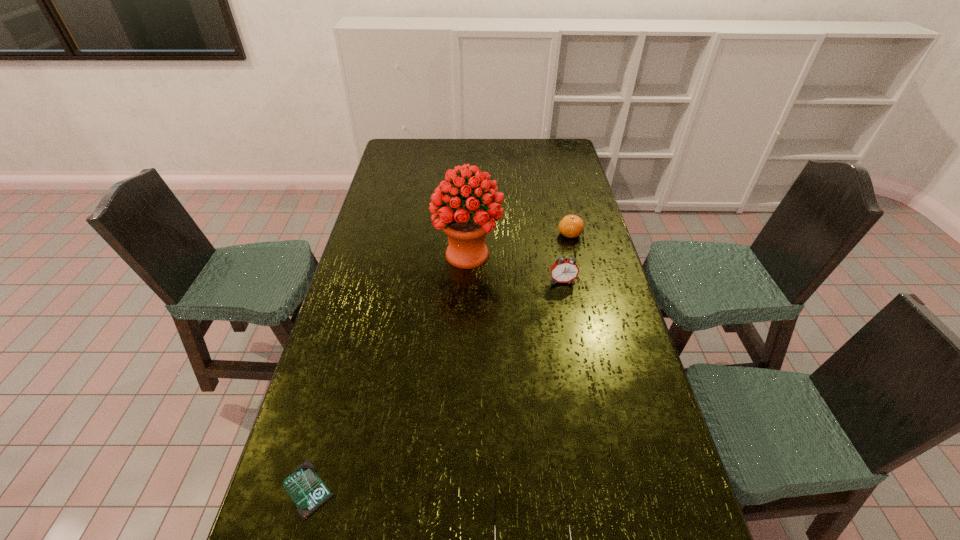
Find the location of a particular element. bouquet is located at coordinates (466, 226).

This screenshot has height=540, width=960. In order to click on the third farthest object in this screenshot , I will do `click(566, 270)`.

I want to click on the second tallest object, so click(566, 270).

This screenshot has height=540, width=960. In order to click on the third tallest object in this screenshot , I will do `click(571, 226)`.

Identify the location of the leftmost object. (304, 486).

You are a GUI agent. You are given a task and a screenshot of the screen. Output one action in this format:
    pyautogui.click(x=<x>, y=<y>)
    Task: Click on the shortest object
    The width and height of the screenshot is (960, 540).
    Given the screenshot: What is the action you would take?
    click(304, 486)

Find the location of a particular element. Image resolution: width=960 pixels, height=540 pixels. free space located on the left of the bouquet is located at coordinates (376, 255).

The width and height of the screenshot is (960, 540). Identify the location of vacant area located on the clock face of the third nearest object. (570, 323).

This screenshot has height=540, width=960. Identify the location of free spot located 0.290m on the front of the third tallest object. (585, 295).

This screenshot has height=540, width=960. I want to click on free spot located 0.340m on the back of the shortest object, so click(x=348, y=348).